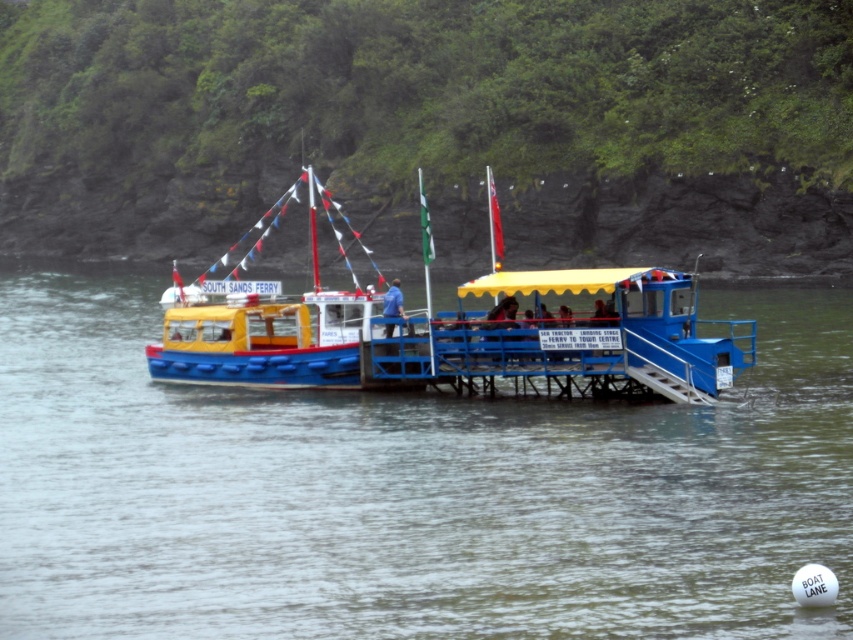
Is transparent water at center to the right of yellow matte ferry at center from the viewer's perspective?

Yes, transparent water at center is to the right of yellow matte ferry at center.

Who is more distant from viewer, (405,404) or (251,300)?

Positioned behind is point (251,300).

This screenshot has height=640, width=853. Find the location of `transparent water at center`. transparent water at center is located at coordinates (407, 490).

Where is `transparent water at center`? transparent water at center is located at coordinates (407, 490).